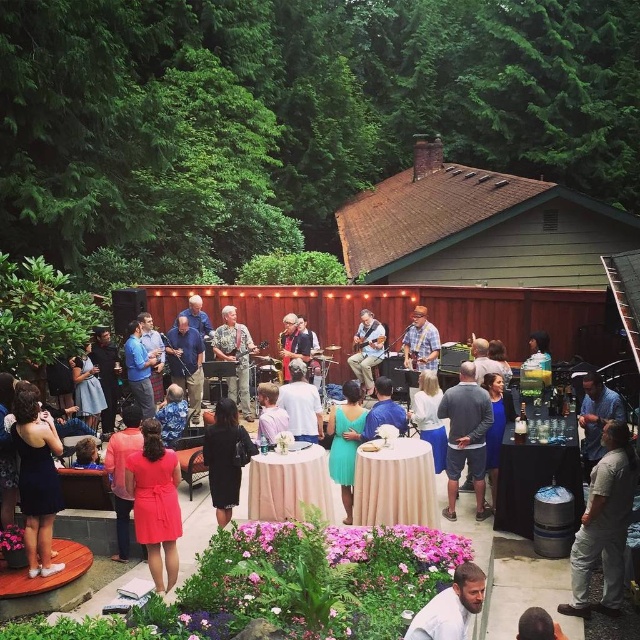
In the scene shown: Does matte black dress at center have a lesser height compared to white matte shirt at lower center?

In fact, matte black dress at center may be taller than white matte shirt at lower center.

Does matte black dress at center have a greater height compared to white matte shirt at lower center?

Yes, matte black dress at center is taller than white matte shirt at lower center.

Which is in front, point (634, 621) or point (461, 572)?

Point (461, 572)

Find the location of `matte black dress at center`. matte black dress at center is located at coordinates (541, 461).

Who is more forward, (385,314) or (596,605)?

Result: Point (596,605) is in front.

Is point (460, 529) farther from camera compared to point (609, 602)?

Yes, point (460, 529) is behind point (609, 602).

Find the location of a particular element. matte black dress at center is located at coordinates (541, 461).

Which is behind, point (157, 529) or point (339, 435)?

The point (339, 435) is more distant.

Describe the element at coordinates (156, 502) in the screenshot. I see `matte red dress at center` at that location.

Which is in front, point (168, 456) or point (340, 445)?

Point (168, 456)

Identify the location of matte red dress at center. (156, 502).